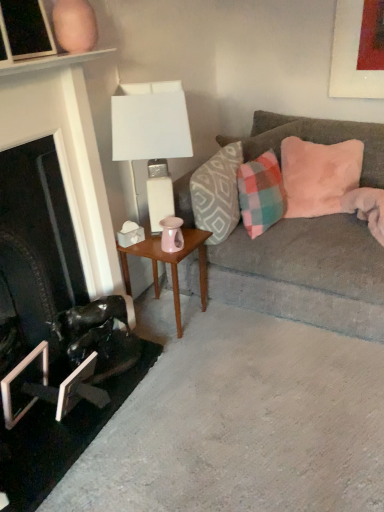
Question: Is velvet gray couch at right positioned beyond the bounds of metallic silver picture frame at lower left, which is the second picture frame in top-to-bottom order?

Choices:
 (A) yes
 (B) no

Answer: (A)

Question: Is velvet gray couch at right in front of metallic silver picture frame at lower left, which is the second picture frame in top-to-bottom order?

Choices:
 (A) yes
 (B) no

Answer: (A)

Question: Is velvet gray couch at right wider than metallic silver picture frame at lower left, which is the second picture frame in top-to-bottom order?

Choices:
 (A) no
 (B) yes

Answer: (B)

Question: Can you confirm if velvet gray couch at right is shorter than metallic silver picture frame at lower left, which is the 2th picture frame in bottom-to-top order?

Choices:
 (A) yes
 (B) no

Answer: (B)

Question: Would you consider velvet gray couch at right to be distant from metallic silver picture frame at lower left, which is the 2th picture frame in bottom-to-top order?

Choices:
 (A) no
 (B) yes

Answer: (B)

Question: Considering the positions of pink plush pillow at upper right, arranged as the third pillow when viewed from the left, and velvet gray couch at right in the image, is pink plush pillow at upper right, arranged as the third pillow when viewed from the left, taller or shorter than velvet gray couch at right?

Choices:
 (A) short
 (B) tall

Answer: (A)

Question: Relative to velvet gray couch at right, is pink plush pillow at upper right, arranged as the third pillow when viewed from the left, in front or behind?

Choices:
 (A) behind
 (B) front

Answer: (A)

Question: In terms of size, does pink plush pillow at upper right, arranged as the third pillow when viewed from the left, appear bigger or smaller than velvet gray couch at right?

Choices:
 (A) big
 (B) small

Answer: (B)

Question: From the image's perspective, relative to velvet gray couch at right, is pink plush pillow at upper right, arranged as the third pillow when viewed from the left, above or below?

Choices:
 (A) above
 (B) below

Answer: (A)

Question: From a real-world perspective, is patterned fabric pillow at center, which ranks as the 1th pillow in left-to-right order, positioned above or below matte black picture frame at upper left, the first picture frame viewed from the top?

Choices:
 (A) below
 (B) above

Answer: (A)

Question: Is patterned fabric pillow at center, which ranks as the 1th pillow in left-to-right order, to the left or to the right of matte black picture frame at upper left, which is the third picture frame in bottom-to-top order, in the image?

Choices:
 (A) right
 (B) left

Answer: (A)

Question: Is patterned fabric pillow at center, which ranks as the 1th pillow in left-to-right order, bigger or smaller than matte black picture frame at upper left, which is the third picture frame in bottom-to-top order?

Choices:
 (A) big
 (B) small

Answer: (A)

Question: Considering the positions of patterned fabric pillow at center, acting as the 3th pillow starting from the right, and matte black picture frame at upper left, which is the third picture frame in bottom-to-top order, in the image, is patterned fabric pillow at center, acting as the 3th pillow starting from the right, taller or shorter than matte black picture frame at upper left, which is the third picture frame in bottom-to-top order,?

Choices:
 (A) tall
 (B) short

Answer: (A)

Question: Considering the relative positions of matte black picture frame at upper left, which is the third picture frame in bottom-to-top order, and plaid fabric pillow at right, the 2th pillow positioned from the left, in the image provided, is matte black picture frame at upper left, which is the third picture frame in bottom-to-top order, to the left or to the right of plaid fabric pillow at right, the 2th pillow positioned from the left,?

Choices:
 (A) left
 (B) right

Answer: (A)

Question: Looking at their shapes, would you say matte black picture frame at upper left, the first picture frame viewed from the top, is wider or thinner than plaid fabric pillow at right, the 2th pillow when ordered from right to left?

Choices:
 (A) thin
 (B) wide

Answer: (A)